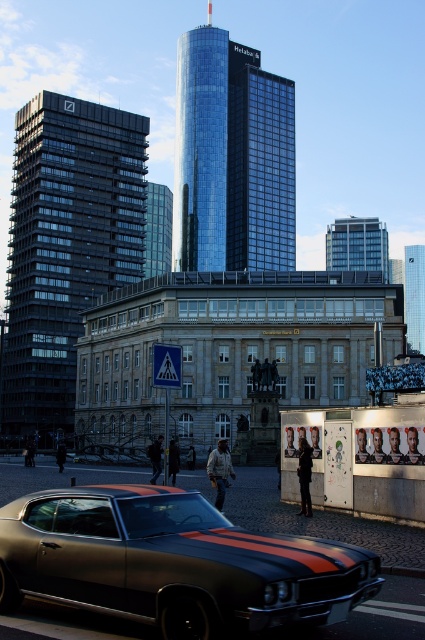
Question: Does glassy metallic skyscraper at center appear on the right side of glassy reflective skyscraper at center?

Choices:
 (A) yes
 (B) no

Answer: (B)

Question: Which point is farther to the camera?

Choices:
 (A) (51, 579)
 (B) (56, 166)
 (C) (346, 248)

Answer: (C)

Question: Which object is closer to the camera taking this photo?

Choices:
 (A) silver glass skyscraper at center
 (B) glassy reflective skyscraper at center
 (C) shiny black car at center

Answer: (C)

Question: From the image, what is the correct spatial relationship of silver glass skyscraper at center in relation to glassy reflective skyscraper at center?

Choices:
 (A) above
 (B) below

Answer: (A)

Question: Which object is positioned closest to the shiny black car at center?

Choices:
 (A) glassy metallic skyscraper at center
 (B) dark glass skyscraper at left

Answer: (B)

Question: Can you confirm if dark glass skyscraper at left is smaller than silver glass skyscraper at center?

Choices:
 (A) yes
 (B) no

Answer: (A)